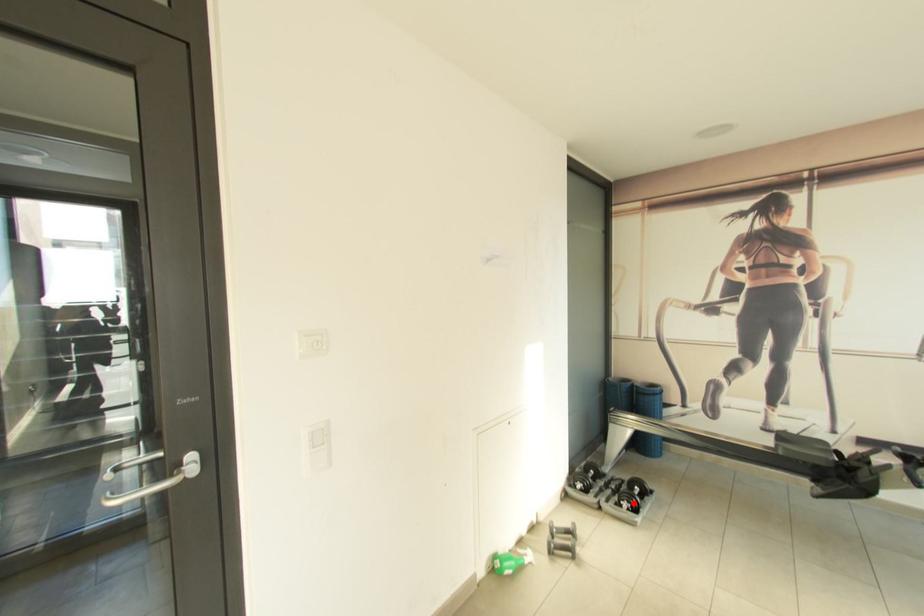
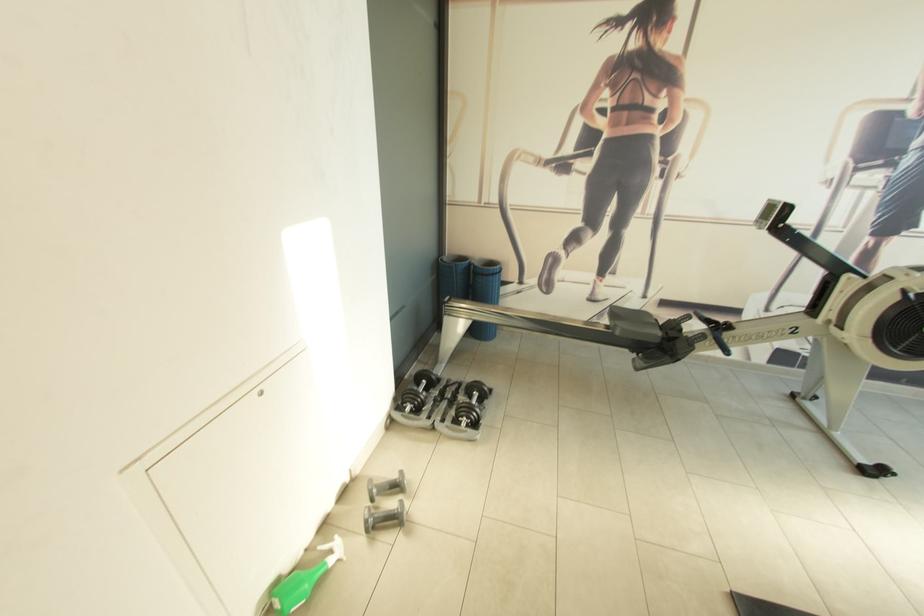
The point at the highlighted location is marked in the first image. Where is the corresponding point in the second image?

(472, 419)